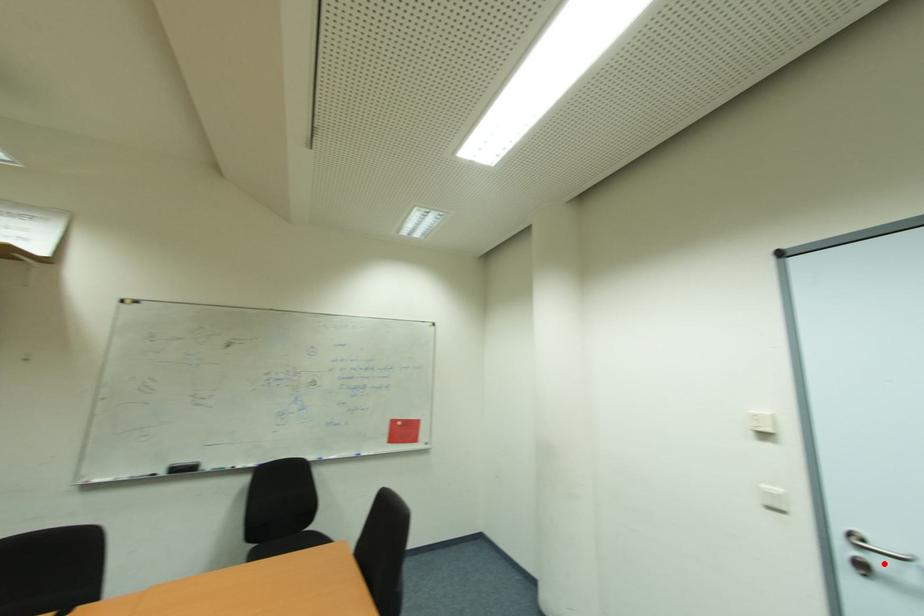
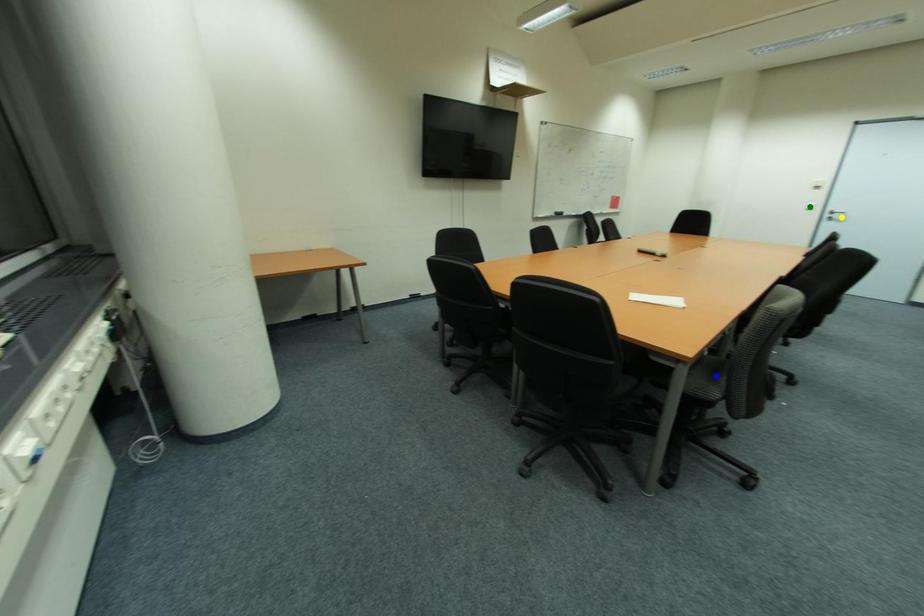
Question: I am providing you with two images of the same scene from different viewpoints. A red point is marked on the first image. You are given multiple points on the second image. Which mark in image 2 goes with the point in image 1?

Choices:
 (A) yellow point
 (B) green point
 (C) blue point

Answer: (A)